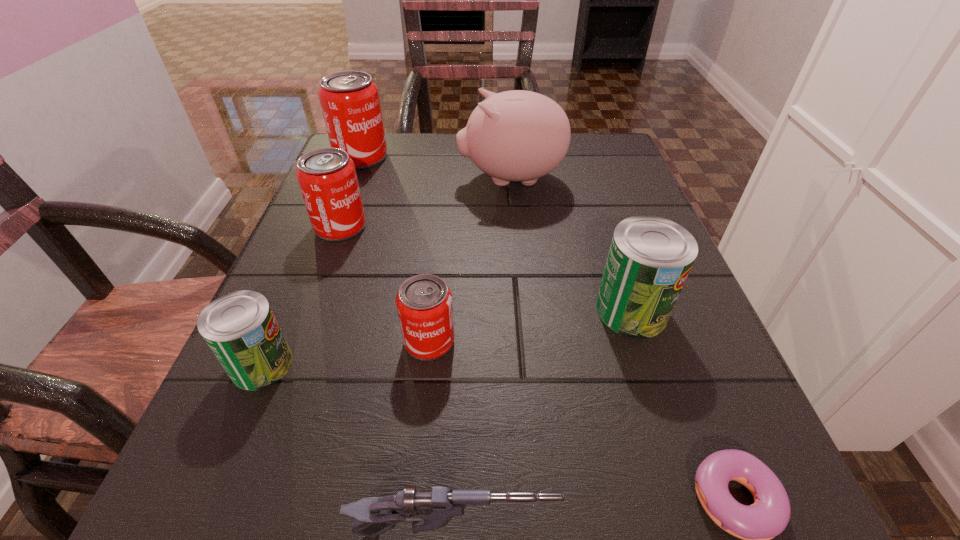
At what (x,y) coordinates should I click in order to perform the action: click on blank region between the farthest red can and the piggy bank. Please return your answer as a coordinate pair (x, y). The width and height of the screenshot is (960, 540). Looking at the image, I should click on (436, 168).

Where is `free space between the piggy bank and the bigger green can`? The width and height of the screenshot is (960, 540). free space between the piggy bank and the bigger green can is located at coordinates (571, 244).

Where is `free space between the biggest red can and the rightmost red can`? This screenshot has width=960, height=540. free space between the biggest red can and the rightmost red can is located at coordinates (396, 249).

The height and width of the screenshot is (540, 960). What are the coordinates of `unoccupied area between the smaller green can and the biggest red can` in the screenshot? It's located at (311, 260).

The height and width of the screenshot is (540, 960). Find the location of `free space between the second nearest red can and the piggy bank`. free space between the second nearest red can and the piggy bank is located at coordinates (425, 202).

Select which object appears as the second closest to the second nearest red can. Please provide its 2D coordinates. Your answer should be formatted as a tuple, i.e. [(x, y)], where the tuple contains the x and y coordinates of a point satisfying the conditions above.

[(517, 135)]

Where is `object that stands as the seventh closest to the gun`? object that stands as the seventh closest to the gun is located at coordinates (349, 100).

Identify which can is the second nearest to the nearest red can. Please provide its 2D coordinates. Your answer should be formatted as a tuple, i.e. [(x, y)], where the tuple contains the x and y coordinates of a point satisfying the conditions above.

[(327, 177)]

In order to click on the second closest can relative to the rightmost red can in this screenshot , I will do `click(327, 177)`.

Select which red can appears as the closest to the smallest red can. Please provide its 2D coordinates. Your answer should be formatted as a tuple, i.e. [(x, y)], where the tuple contains the x and y coordinates of a point satisfying the conditions above.

[(327, 177)]